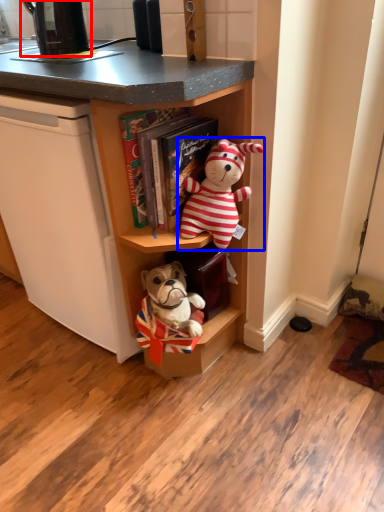
Question: Which object is further to the camera taking this photo, appliance (highlighted by a red box) or toy (highlighted by a blue box)?

Choices:
 (A) appliance
 (B) toy

Answer: (A)